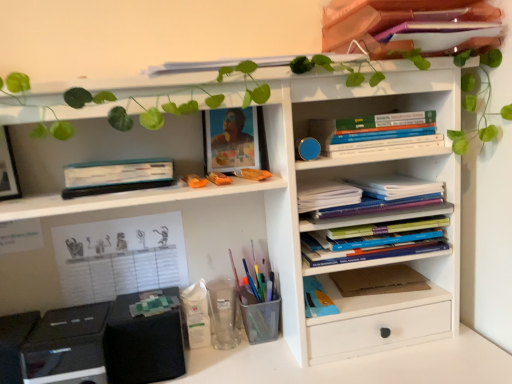
Question: Is white paper notebook at center right, marked as the third book in a top-to-bottom arrangement, smaller than metal mesh pen holder at lower center, which is the third stationery in left-to-right order?

Choices:
 (A) yes
 (B) no

Answer: (B)

Question: Is the depth of white paper notebook at center right, the second book ordered from the bottom, greater than that of metal mesh pen holder at lower center, the first stationery from the right?

Choices:
 (A) yes
 (B) no

Answer: (B)

Question: Can metal mesh pen holder at lower center, which is the third stationery in left-to-right order, be found inside white paper notebook at center right, the second book ordered from the bottom?

Choices:
 (A) no
 (B) yes

Answer: (A)

Question: Can you confirm if white paper notebook at center right, the second book ordered from the bottom, is shorter than metal mesh pen holder at lower center, the first stationery from the right?

Choices:
 (A) no
 (B) yes

Answer: (B)

Question: Can you confirm if white paper notebook at center right, marked as the third book in a top-to-bottom arrangement, is positioned to the right of metal mesh pen holder at lower center, the first stationery from the right?

Choices:
 (A) yes
 (B) no

Answer: (A)

Question: Considering the relative positions of white paper notebook at center right, marked as the third book in a top-to-bottom arrangement, and metal mesh pen holder at lower center, the first stationery from the right, in the image provided, is white paper notebook at center right, marked as the third book in a top-to-bottom arrangement, to the left of metal mesh pen holder at lower center, the first stationery from the right, from the viewer's perspective?

Choices:
 (A) no
 (B) yes

Answer: (A)

Question: Is white paper at left, which appears as the 1th paperback book when viewed from the left, positioned far away from teal matte hardcover book at left, which appears as the second paperback book when viewed from the left?

Choices:
 (A) yes
 (B) no

Answer: (B)

Question: Is the position of white paper at left, which is the second paperback book in top-to-bottom order, less distant than that of teal matte hardcover book at left, acting as the second paperback book starting from the right?

Choices:
 (A) no
 (B) yes

Answer: (A)

Question: Is white paper at left, which is the 3th paperback book from right to left, looking in the opposite direction of teal matte hardcover book at left, which is counted as the first paperback book, starting from the top?

Choices:
 (A) no
 (B) yes

Answer: (A)

Question: Is white paper at left, arranged as the 2th paperback book when ordered from the bottom, to the right of teal matte hardcover book at left, acting as the second paperback book starting from the right, from the viewer's perspective?

Choices:
 (A) yes
 (B) no

Answer: (B)

Question: Is teal matte hardcover book at left, which appears as the second paperback book when viewed from the left, surrounded by white paper at left, arranged as the 2th paperback book when ordered from the bottom?

Choices:
 (A) no
 (B) yes

Answer: (A)

Question: From a real-world perspective, does white paper at left, which is the second paperback book in top-to-bottom order, sit lower than teal matte hardcover book at left, the 3th paperback book when ordered from bottom to top?

Choices:
 (A) yes
 (B) no

Answer: (A)

Question: Is matte plastic picture frame at upper center facing away from transparent plastic cup at lower center, which is the 2th stationery from right to left?

Choices:
 (A) no
 (B) yes

Answer: (A)